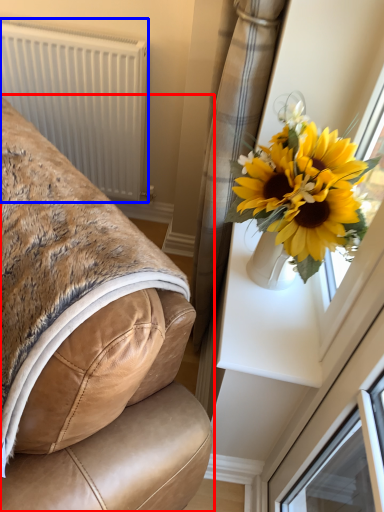
Question: Which point is further to the camera, furniture (highlighted by a red box) or radiator (highlighted by a blue box)?

Choices:
 (A) furniture
 (B) radiator

Answer: (B)